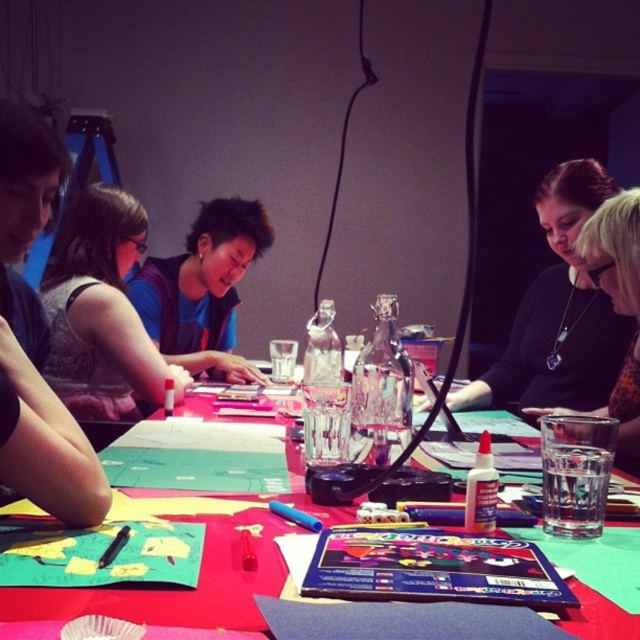
Does matte black marker at center appear on the right side of black necklace at upper right?

Incorrect, matte black marker at center is not on the right side of black necklace at upper right.

Is matte black marker at center behind black necklace at upper right?

Yes, matte black marker at center is further from the viewer.

Which is behind, point (72, 204) or point (611, 394)?

The point (72, 204) is more distant.

Where is `matte black marker at center`? The image size is (640, 640). matte black marker at center is located at coordinates (100, 310).

Can you confirm if matte black marker at center is positioned above black matte shirt at upper center?

Actually, matte black marker at center is below black matte shirt at upper center.

Consider the image. Does matte black marker at center have a greater height compared to black matte shirt at upper center?

In fact, matte black marker at center may be shorter than black matte shirt at upper center.

Is point (177, 365) less distant than point (596, 314)?

No.

Find the location of a particular element. matte black marker at center is located at coordinates (100, 310).

Is red paper table at center further to camera compared to matte blue shirt at center?

No, red paper table at center is in front of matte blue shirt at center.

Does red paper table at center have a smaller size compared to matte blue shirt at center?

Yes, red paper table at center is smaller than matte blue shirt at center.

Between point (163, 604) and point (196, 310), which one is positioned in front?

Point (163, 604)

Locate an element on the screen. The image size is (640, 640). red paper table at center is located at coordinates (173, 589).